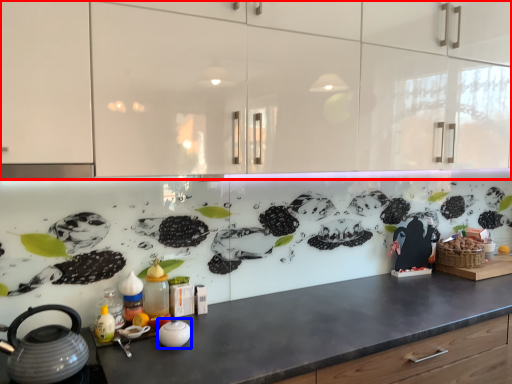
Question: Which of the following is the closest to the observer, cabinetry (highlighted by a red box) or appliance (highlighted by a blue box)?

Choices:
 (A) cabinetry
 (B) appliance

Answer: (A)